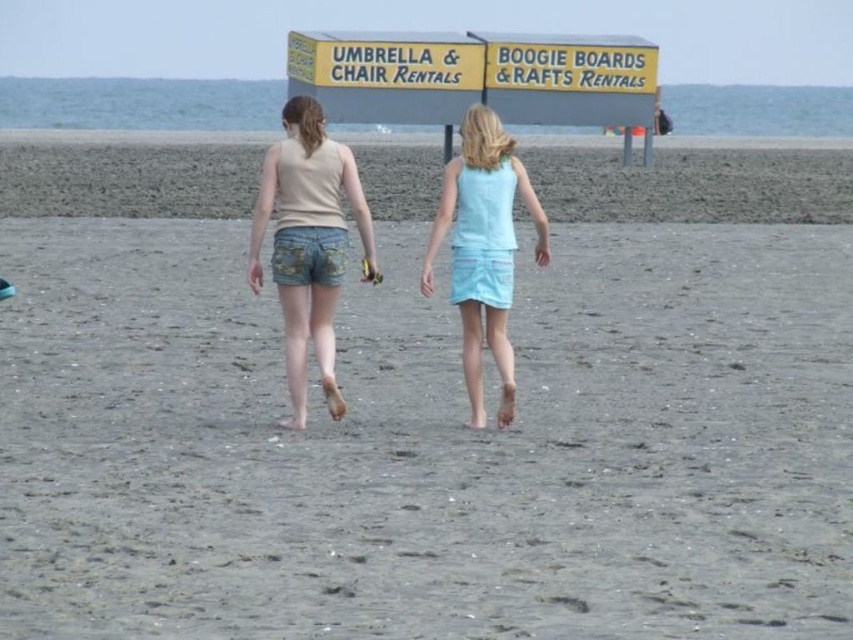
Question: Does gray sand at center have a larger size compared to light blue fabric skirt at center?

Choices:
 (A) no
 (B) yes

Answer: (B)

Question: Does light blue denim shorts at center appear on the left side of denim shorts at center?

Choices:
 (A) no
 (B) yes

Answer: (B)

Question: Which is farther from the light blue fabric skirt at center?

Choices:
 (A) light blue denim shorts at center
 (B) gray sand at center

Answer: (A)

Question: Among these objects, which one is farthest from the camera?

Choices:
 (A) gray sand at center
 (B) light blue denim shorts at center

Answer: (B)

Question: Which point is closer to the camera?

Choices:
 (A) light blue denim shorts at center
 (B) denim shorts at center
 (C) light blue fabric skirt at center
 (D) gray sand at center

Answer: (D)

Question: Observing the image, what is the correct spatial positioning of gray sand at center in reference to light blue denim shorts at center?

Choices:
 (A) below
 (B) above

Answer: (A)